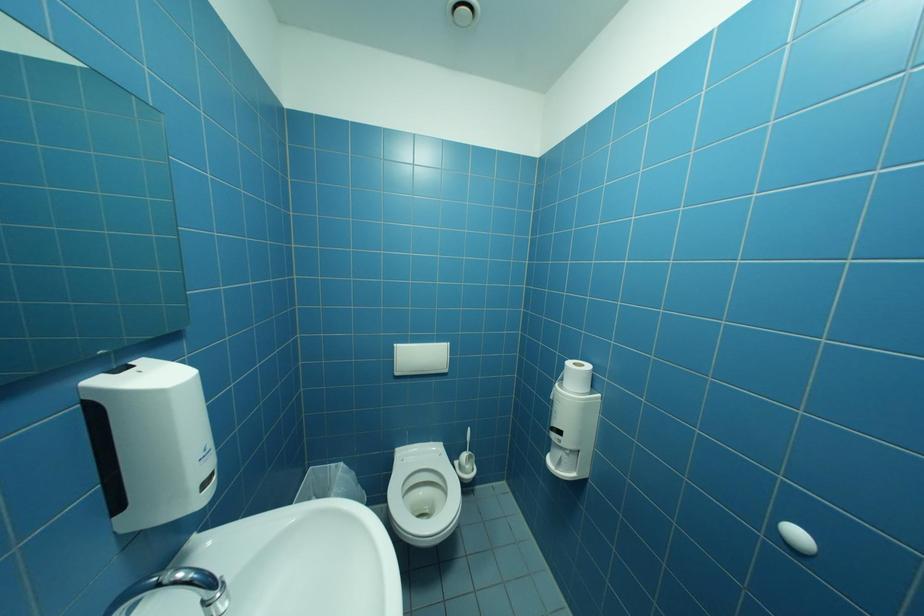
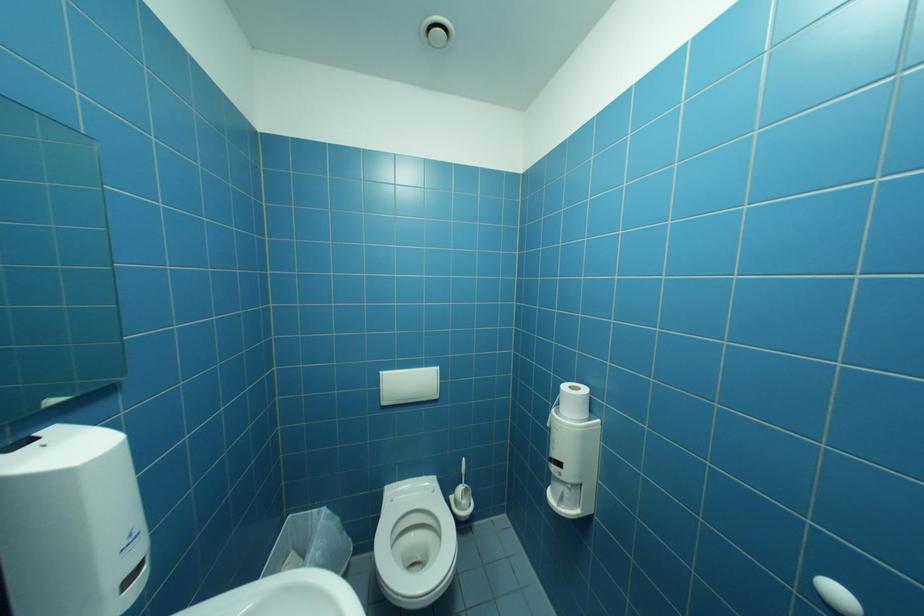
In a continuous first-person perspective shot, in which direction is the camera moving?

The movement direction of the cameraman is right, forward.